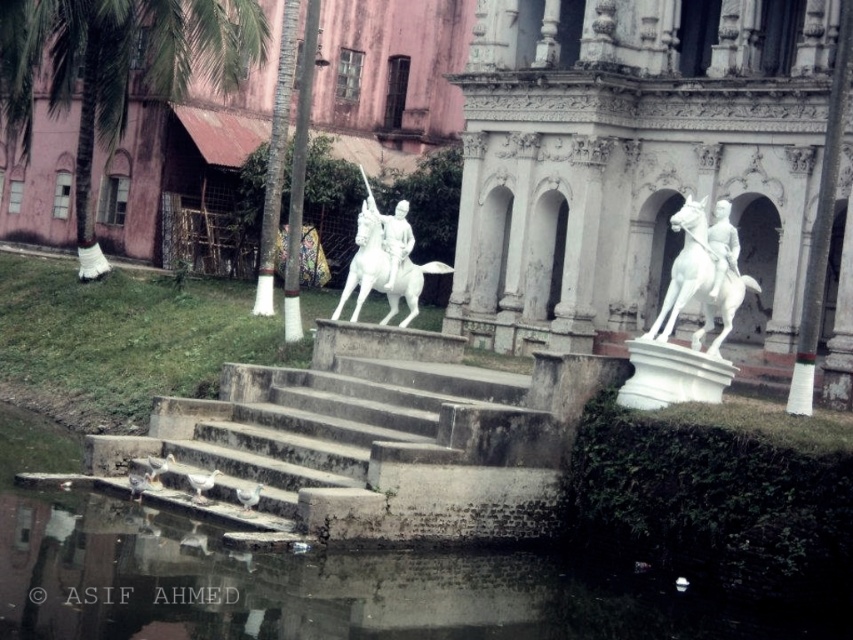
You are a tourist standing at the bottom of the steps leading to the statues. You want to take a photo of both the white marble horse at center and the white glossy horse at center without any obstructions. Which horse should you position closer to the camera to ensure both are fully visible in the frame?

The white marble horse at center is in front of the white glossy horse at center, so positioning the white marble horse at center closer to the camera will allow both to be visible without obstruction.

You are standing in the outdoor area and want to take a photo of the white marble statue at center and the green leafy palm tree at upper left. Which object should you focus on first to ensure both are in the frame?

You should focus on the white marble statue at center first because it is closer to you than the green leafy palm tree at upper left, so adjusting the camera to include both would require starting with the closer object.

You are an architect analyzing the spatial layout of this historical site. You need to determine the relative positioning of the green leafy palm tree at upper left and the white glossy statue at center. Based on the scene, which object is positioned higher in the image?

The green leafy palm tree at upper left is positioned above the white glossy statue at center, so it is higher in the image.